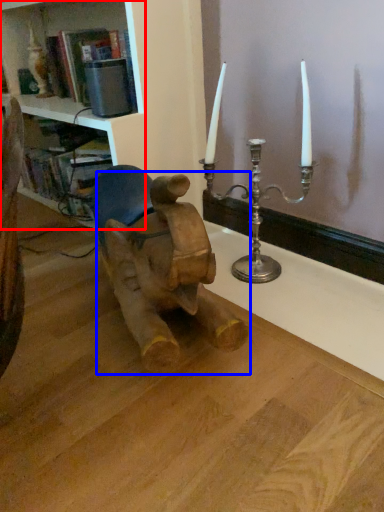
Question: Which of the following is the farthest to the observer, shelf (highlighted by a red box) or baby elephant (highlighted by a blue box)?

Choices:
 (A) shelf
 (B) baby elephant

Answer: (A)